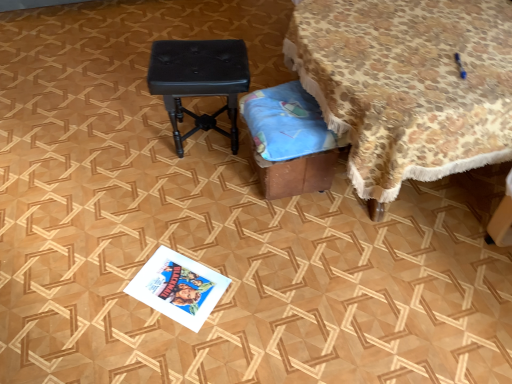
Locate an element on the screen. free space to the left of white glossy magazine at lower center is located at coordinates (106, 288).